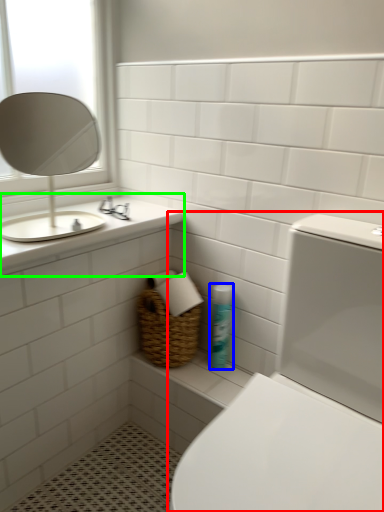
Question: Considering the real-world distances, which object is farthest from toilet (highlighted by a red box)? cleaning product (highlighted by a blue box) or counter top (highlighted by a green box)?

Choices:
 (A) cleaning product
 (B) counter top

Answer: (B)